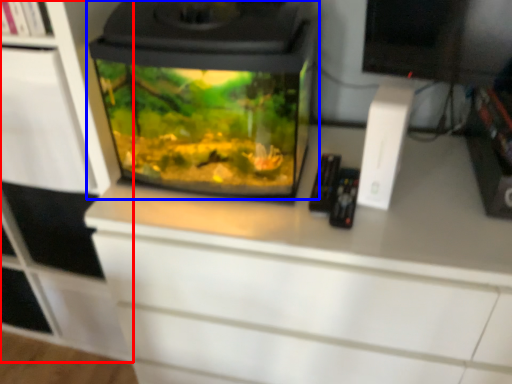
Question: Which of the following is the farthest to the observer, cabinetry (highlighted by a red box) or home appliance (highlighted by a blue box)?

Choices:
 (A) cabinetry
 (B) home appliance

Answer: (A)